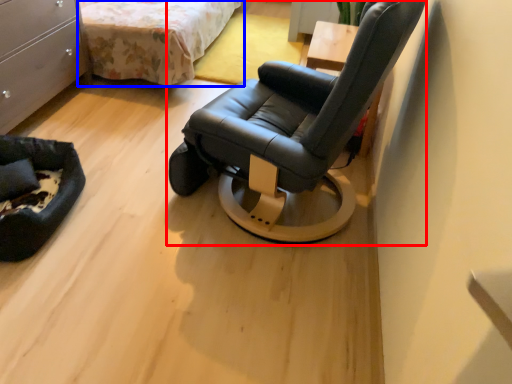
Question: Which of the following is the closest to the observer, chair (highlighted by a red box) or bed (highlighted by a blue box)?

Choices:
 (A) chair
 (B) bed

Answer: (A)